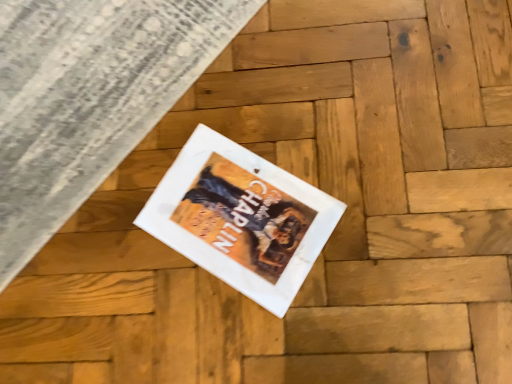
Locate an element on the screen. The width and height of the screenshot is (512, 384). vacant space underneath white matte picture frame at center (from a real-world perspective) is located at coordinates (237, 211).